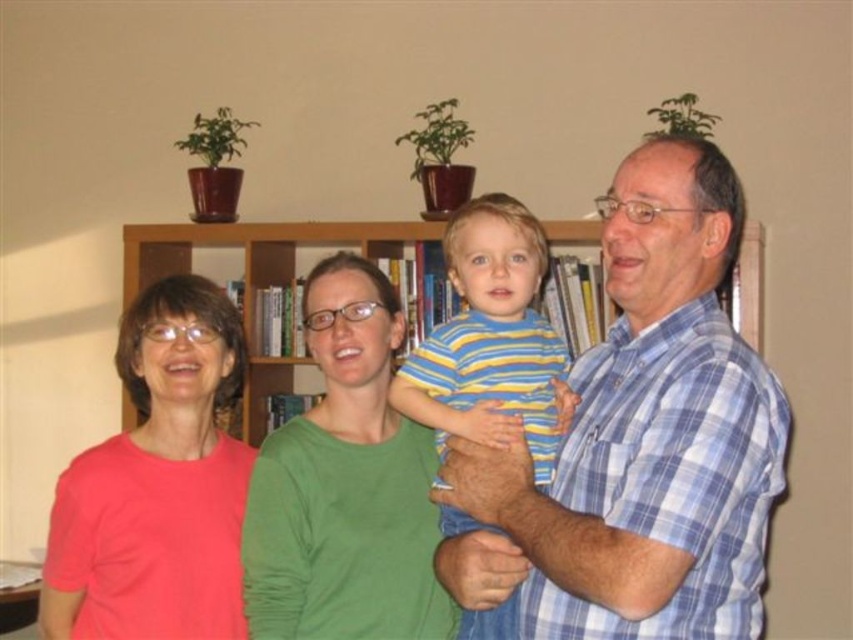
The image size is (853, 640). Find the location of `blue plaid shirt at right`. blue plaid shirt at right is located at coordinates (640, 438).

Measure the distance between blue plaid shirt at right and camera.

The distance of blue plaid shirt at right from camera is 1.13 meters.

Where is `blue plaid shirt at right`? The width and height of the screenshot is (853, 640). blue plaid shirt at right is located at coordinates (640, 438).

Is point (549, 634) farther from viewer compared to point (463, 387)?

No, (549, 634) is closer to viewer.

This screenshot has height=640, width=853. What are the coordinates of `blue plaid shirt at right` in the screenshot? It's located at (640, 438).

Image resolution: width=853 pixels, height=640 pixels. Identify the location of blue plaid shirt at right. (640, 438).

At what (x,y) coordinates should I click in order to perform the action: click on blue plaid shirt at right. Please return your answer as a coordinate pair (x, y). This screenshot has width=853, height=640. Looking at the image, I should click on pyautogui.click(x=640, y=438).

Does matte pink shirt at left have a lesser height compared to wooden bookshelf at center?

Yes, matte pink shirt at left is shorter than wooden bookshelf at center.

Based on the photo, is matte pink shirt at left thinner than wooden bookshelf at center?

Indeed, matte pink shirt at left has a lesser width compared to wooden bookshelf at center.

Which is in front, point (180, 468) or point (149, 225)?

Point (180, 468)

In order to click on matte pink shirt at left in this screenshot , I will do `click(157, 484)`.